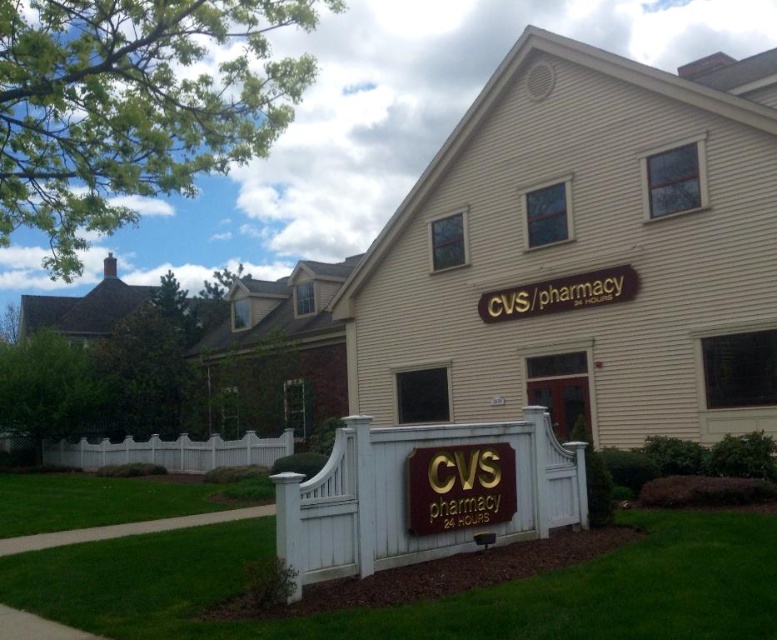
You are standing in front of the CVS Pharmacy building and notice two fences. Which fence, the white wood fence at center or the white picket fence at lower left, is closer to you?

The white wood fence at center is closer because it is positioned over the white picket fence at lower left, indicating it is in front.

You are standing in front of the CVS Pharmacy building and want to take a photo of both the gold metallic cvs pharmacy sign at center and the white picket fence at lower left. Can you frame them in the same shot without moving your position?

Yes, because the gold metallic cvs pharmacy sign at center is above the white picket fence at lower left, so they can be captured in the same frame without moving your position.